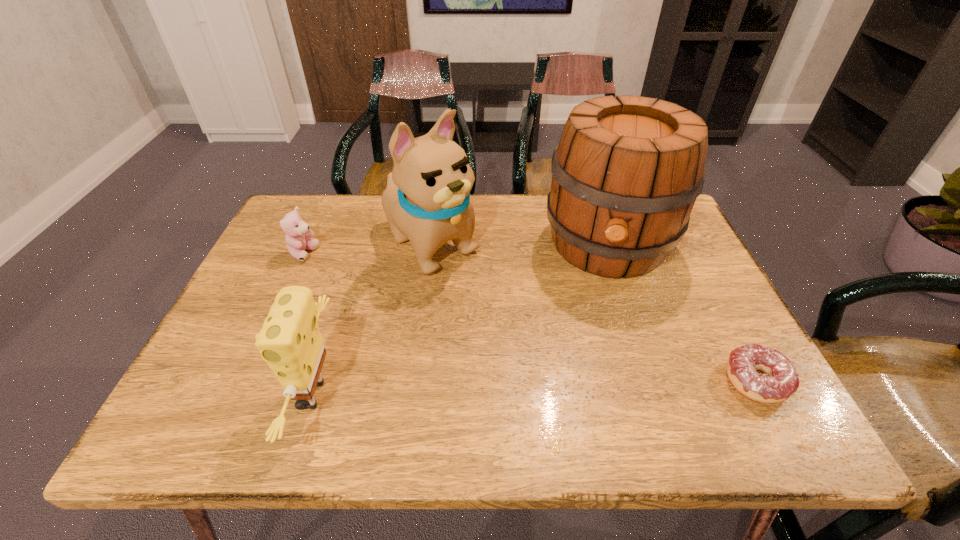
Identify the location of vacant space on the desktop that is between the third tallest object and the shortest object and is positioned at the face of the leftmost object. (523, 388).

Identify the location of vacant spot on the desktop that is between the third shortest object and the shortest object and is positioned on the side of the cider where the spigot is located. (592, 386).

In order to click on vacant spot on the desktop that is between the third shortest object and the doughnut and is positioned on the face of the puppy in this screenshot , I will do `click(596, 386)`.